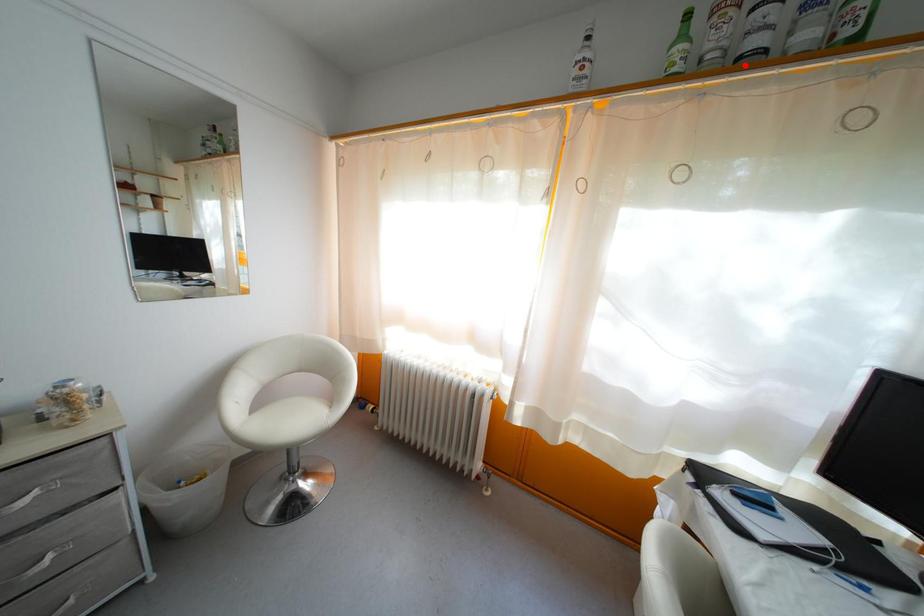
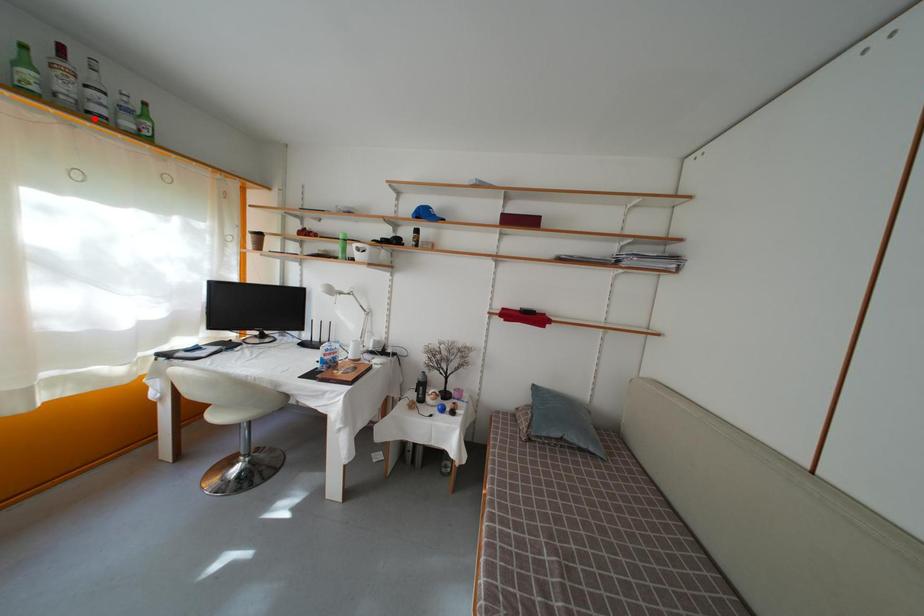
I am providing you with two images of the same scene from different viewpoints. A red point is marked on the first image and another point is marked on the second image. Do the highlighted points in image1 and image2 indicate the same real-world spot?

Yes